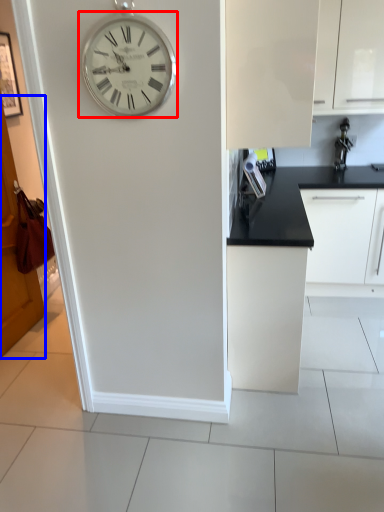
Question: Which point is closer to the camera, wall clock (highlighted by a red box) or door (highlighted by a blue box)?

Choices:
 (A) wall clock
 (B) door

Answer: (A)